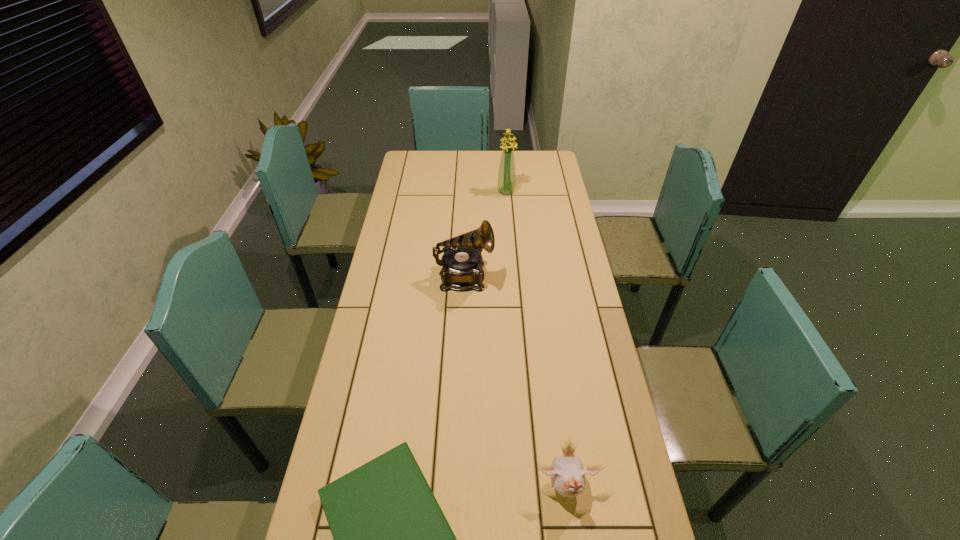
What are the coordinates of `bouquet` in the screenshot? It's located at 506,183.

Where is `phonograph record`? This screenshot has height=540, width=960. phonograph record is located at coordinates (462, 261).

At what (x,y) coordinates should I click in order to perform the action: click on the second shortest object. Please return your answer as a coordinate pair (x, y). The image size is (960, 540). Looking at the image, I should click on (568, 478).

You are a GUI agent. You are given a task and a screenshot of the screen. Output one action in this format:
    pyautogui.click(x=<x>, y=<y>)
    Task: Click on the free spot located 0.220m on the front-facing side of the bouquet
    The height and width of the screenshot is (540, 960).
    Given the screenshot: What is the action you would take?
    pyautogui.click(x=509, y=227)

Find the location of a particular element. The height and width of the screenshot is (540, 960). vacant area situated on the horn of the second farthest object is located at coordinates (543, 278).

Identify the location of vacant space located 0.050m at the beak of the third tallest object. (572, 538).

The height and width of the screenshot is (540, 960). I want to click on object at the right edge, so click(x=568, y=478).

The height and width of the screenshot is (540, 960). What are the coordinates of `vacant area at the far edge of the desktop` in the screenshot? It's located at (483, 174).

In the image, there is a desktop. Where is `vacant region at the left edge`? vacant region at the left edge is located at coordinates (420, 222).

Locate an element on the screen. The image size is (960, 540). blank space at the right edge is located at coordinates (548, 242).